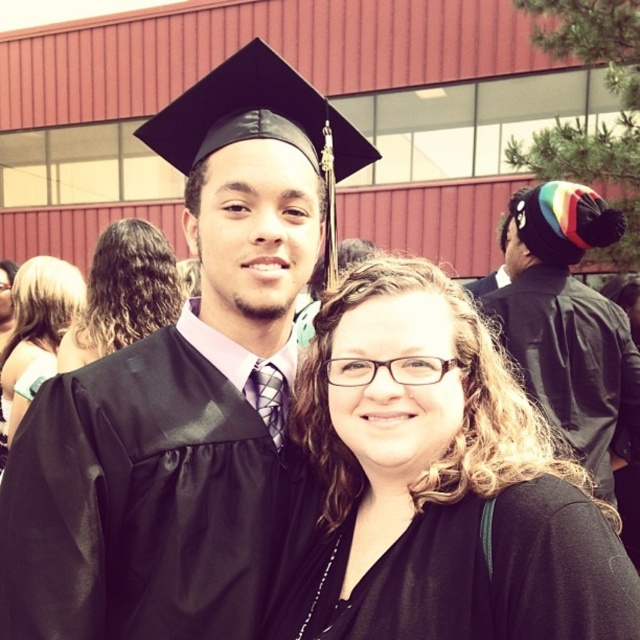
Is point (113, 412) in front of point (6, 358)?

That is True.

The width and height of the screenshot is (640, 640). Identify the location of black satin gown at center. (145, 497).

Who is positioned more to the right, black satin gown at center or multicolored knit hat at upper right?

Positioned to the right is multicolored knit hat at upper right.

Does black satin gown at center come behind multicolored knit hat at upper right?

No, black satin gown at center is closer to the viewer.

You are a GUI agent. You are given a task and a screenshot of the screen. Output one action in this format:
    pyautogui.click(x=<x>, y=<y>)
    Task: Click on the black satin gown at center
    The width and height of the screenshot is (640, 640).
    Given the screenshot: What is the action you would take?
    pyautogui.click(x=145, y=497)

Does satin black graduation gown at center have a smaller size compared to blonde hair at center?

No.

Can you confirm if satin black graduation gown at center is thinner than blonde hair at center?

In fact, satin black graduation gown at center might be wider than blonde hair at center.

You are a GUI agent. You are given a task and a screenshot of the screen. Output one action in this format:
    pyautogui.click(x=<x>, y=<y>)
    Task: Click on the satin black graduation gown at center
    
    Given the screenshot: What is the action you would take?
    pyautogui.click(x=182, y=392)